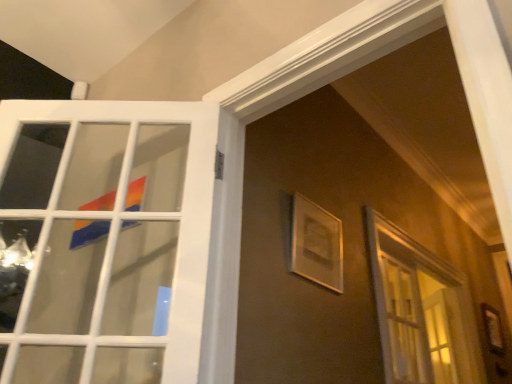
Question: Would you say white glossy door at upper left is to the left or to the right of matte white picture frame at upper center in the picture?

Choices:
 (A) right
 (B) left

Answer: (B)

Question: Considering their positions, is white glossy door at upper left located in front of or behind matte white picture frame at upper center?

Choices:
 (A) front
 (B) behind

Answer: (A)

Question: Considering the positions of white glossy door at upper left and matte white picture frame at upper center in the image, is white glossy door at upper left taller or shorter than matte white picture frame at upper center?

Choices:
 (A) short
 (B) tall

Answer: (B)

Question: From their relative heights in the image, would you say matte white picture frame at upper center is taller or shorter than white glossy door at upper left?

Choices:
 (A) short
 (B) tall

Answer: (A)

Question: Is point (306, 236) closer or farther from the camera than point (153, 281)?

Choices:
 (A) farther
 (B) closer

Answer: (A)

Question: Considering the positions of matte white picture frame at upper center and white glossy door at upper left in the image, is matte white picture frame at upper center bigger or smaller than white glossy door at upper left?

Choices:
 (A) big
 (B) small

Answer: (B)

Question: Would you say matte white picture frame at upper center is to the left or to the right of white glossy door at upper left in the picture?

Choices:
 (A) right
 (B) left

Answer: (A)